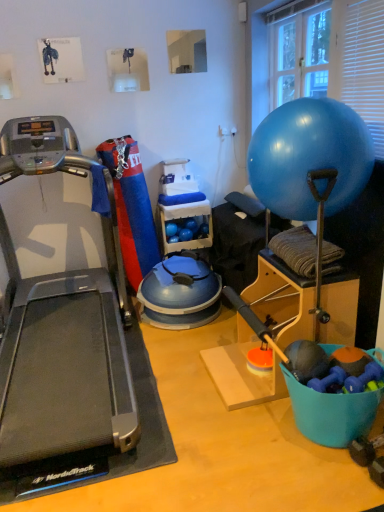
Locate an element on the screen. vacant space to the left of blue plastic bucket at lower right is located at coordinates (265, 442).